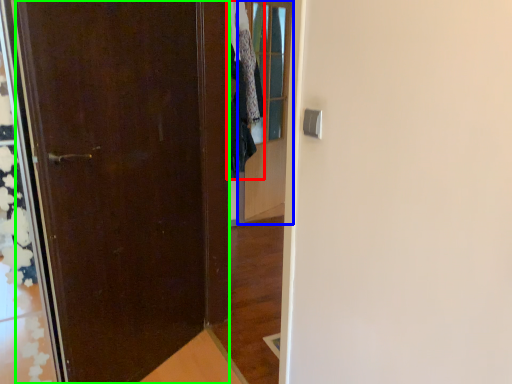
Question: Which object is positioned farthest from clothing (highlighted by a red box)? Select from glass door (highlighted by a blue box) and door (highlighted by a green box).

Choices:
 (A) glass door
 (B) door

Answer: (B)